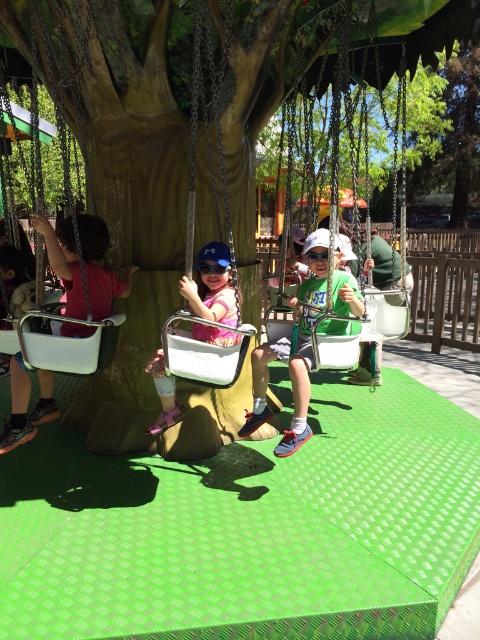
Question: Which point appears farthest from the camera in this image?

Choices:
 (A) (219, 77)
 (B) (172, 413)
 (C) (323, 257)
 (D) (220, 272)

Answer: (B)

Question: From the image, what is the correct spatial relationship of matte white swing at left in relation to matte pink shirt at center?

Choices:
 (A) right
 (B) left

Answer: (B)

Question: Which object is positioned closest to the blue reflective goggles at center?

Choices:
 (A) matte white swing at left
 (B) matte pink shirt at center

Answer: (B)

Question: Which object is farther from the camera taking this photo?

Choices:
 (A) blue reflective goggles at center
 (B) green matte shirt at center
 (C) matte pink shirt at center

Answer: (A)

Question: Can you confirm if matte white swing at left is thinner than glossy plastic goggles at center?

Choices:
 (A) yes
 (B) no

Answer: (B)

Question: Does white plastic swing at center appear on the right side of blue reflective goggles at center?

Choices:
 (A) yes
 (B) no

Answer: (A)